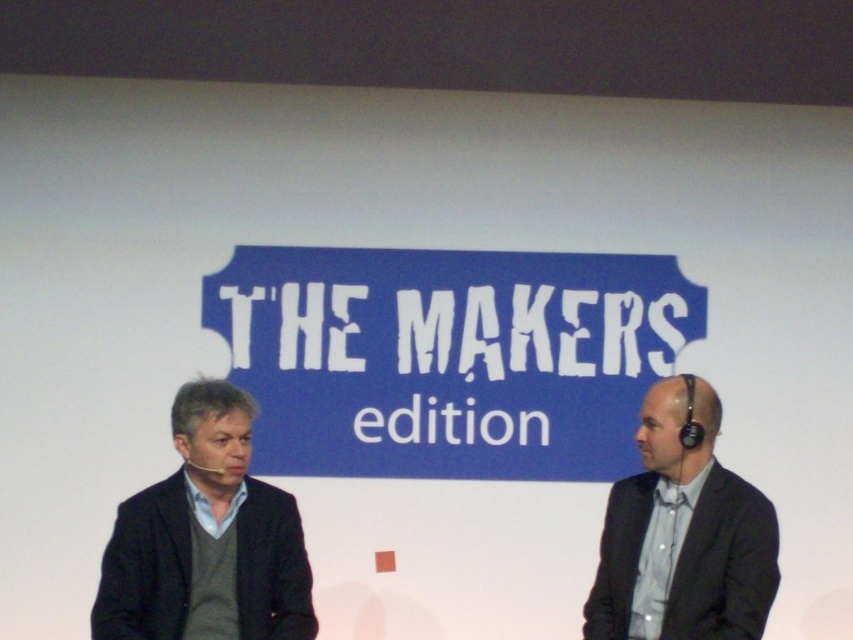
Question: Is dark gray sweater at left positioned in front of gray fabric suit at right?

Choices:
 (A) no
 (B) yes

Answer: (A)

Question: Is dark gray sweater at left below gray fabric suit at right?

Choices:
 (A) yes
 (B) no

Answer: (A)

Question: Among these points, which one is farthest from the camera?

Choices:
 (A) (206, 573)
 (B) (772, 522)

Answer: (A)

Question: Is dark gray sweater at left behind gray fabric suit at right?

Choices:
 (A) yes
 (B) no

Answer: (A)

Question: Among these points, which one is nearest to the camera?

Choices:
 (A) (757, 586)
 (B) (276, 499)

Answer: (A)

Question: Which point is farther from the camera taking this photo?

Choices:
 (A) (173, 516)
 (B) (663, 634)

Answer: (A)